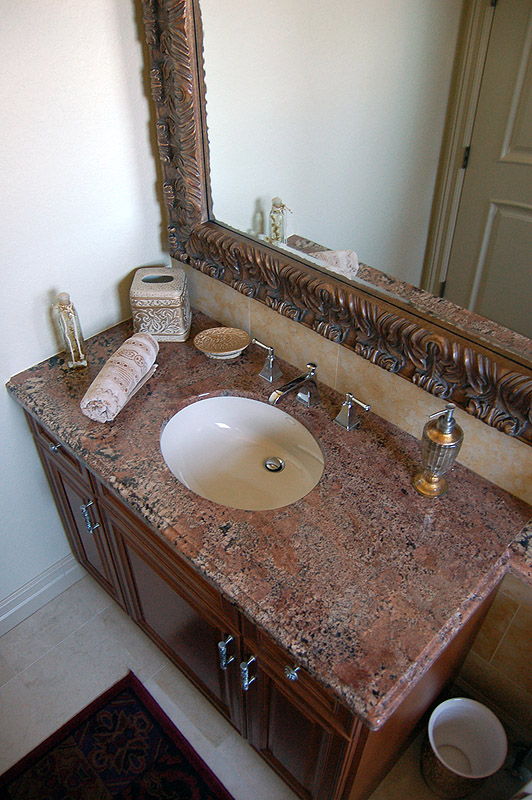
Identify the location of ceramic waste bin. The width and height of the screenshot is (532, 800). (439, 753).